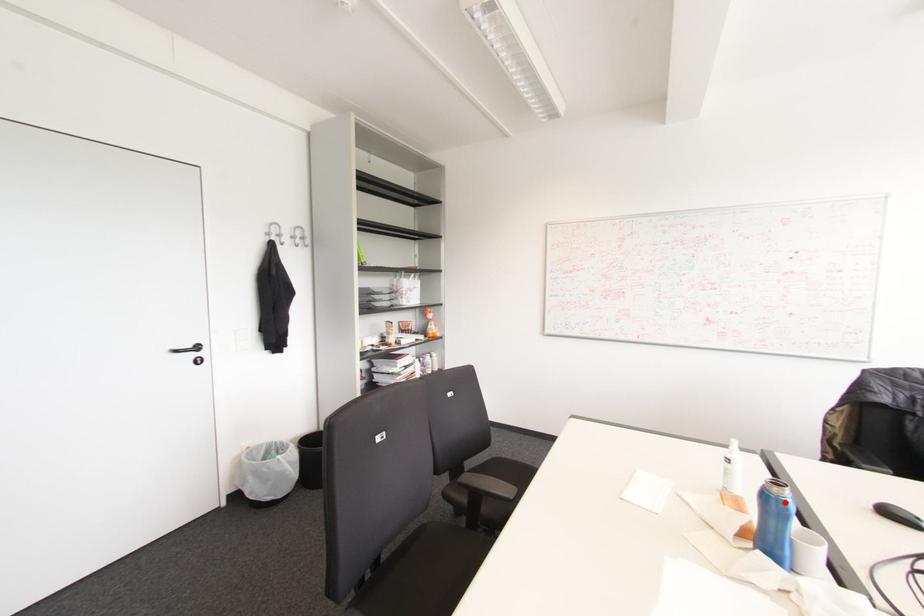
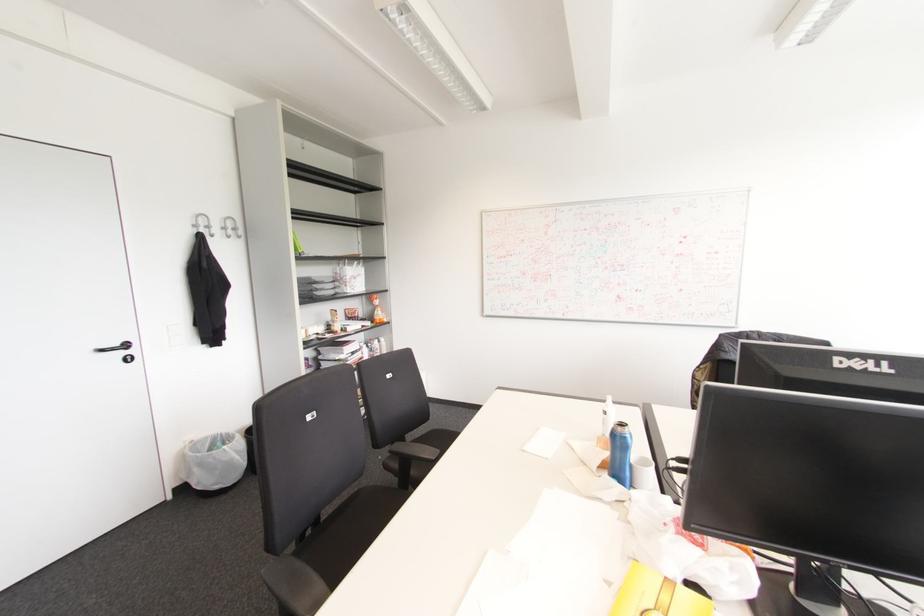
In the second image, find the point that corresponds to the highlighted location in the first image.

(625, 438)